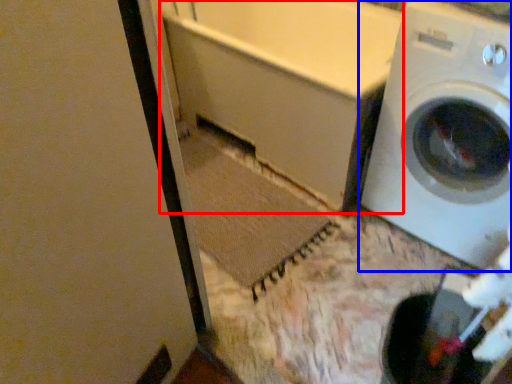
Question: Which point is further to the camera, bath (highlighted by a red box) or washing machine (highlighted by a blue box)?

Choices:
 (A) bath
 (B) washing machine

Answer: (A)